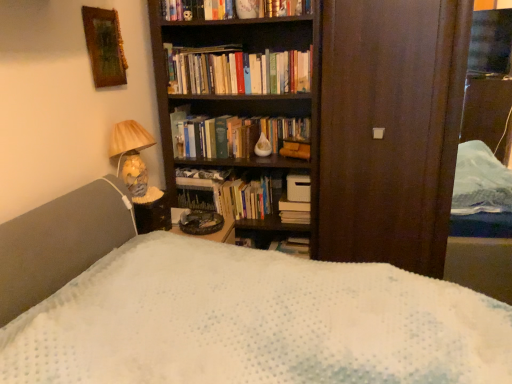
Question: Is wooden picture frame at upper left positioned with its back to hardcover book at center, positioned as the second book in front-to-back order?

Choices:
 (A) yes
 (B) no

Answer: (B)

Question: Is wooden picture frame at upper left smaller than hardcover book at center, positioned as the second book in front-to-back order?

Choices:
 (A) yes
 (B) no

Answer: (A)

Question: Considering the relative positions of wooden picture frame at upper left and hardcover book at center, placed as the first book when sorted from back to front, in the image provided, is wooden picture frame at upper left to the right of hardcover book at center, placed as the first book when sorted from back to front, from the viewer's perspective?

Choices:
 (A) yes
 (B) no

Answer: (B)

Question: Is the surface of wooden picture frame at upper left in direct contact with hardcover book at center, placed as the first book when sorted from back to front?

Choices:
 (A) no
 (B) yes

Answer: (A)

Question: Is wooden picture frame at upper left far away from hardcover book at center, placed as the first book when sorted from back to front?

Choices:
 (A) yes
 (B) no

Answer: (B)

Question: Does wooden picture frame at upper left have a larger size compared to hardcover book at center, positioned as the second book in front-to-back order?

Choices:
 (A) yes
 (B) no

Answer: (B)

Question: Can you confirm if hardcover books at upper center, the 2th book positioned from the back, is positioned to the right of matte ceramic lamp at left?

Choices:
 (A) no
 (B) yes

Answer: (B)

Question: Does hardcover books at upper center, the 2th book positioned from the back, lie in front of matte ceramic lamp at left?

Choices:
 (A) yes
 (B) no

Answer: (B)

Question: Is hardcover books at upper center, marked as the second book in a bottom-to-top arrangement, outside matte ceramic lamp at left?

Choices:
 (A) yes
 (B) no

Answer: (A)

Question: Is hardcover books at upper center, which is the first book in front-to-back order, far from matte ceramic lamp at left?

Choices:
 (A) yes
 (B) no

Answer: (B)

Question: Is hardcover books at upper center, marked as the second book in a bottom-to-top arrangement, smaller than matte ceramic lamp at left?

Choices:
 (A) yes
 (B) no

Answer: (A)

Question: Does hardcover books at upper center, which is counted as the first book, starting from the top, have a lesser width compared to matte ceramic lamp at left?

Choices:
 (A) no
 (B) yes

Answer: (B)

Question: Is hardcover book at center, placed as the first book when sorted from back to front, positioned with its back to wooden picture frame at upper left?

Choices:
 (A) no
 (B) yes

Answer: (A)